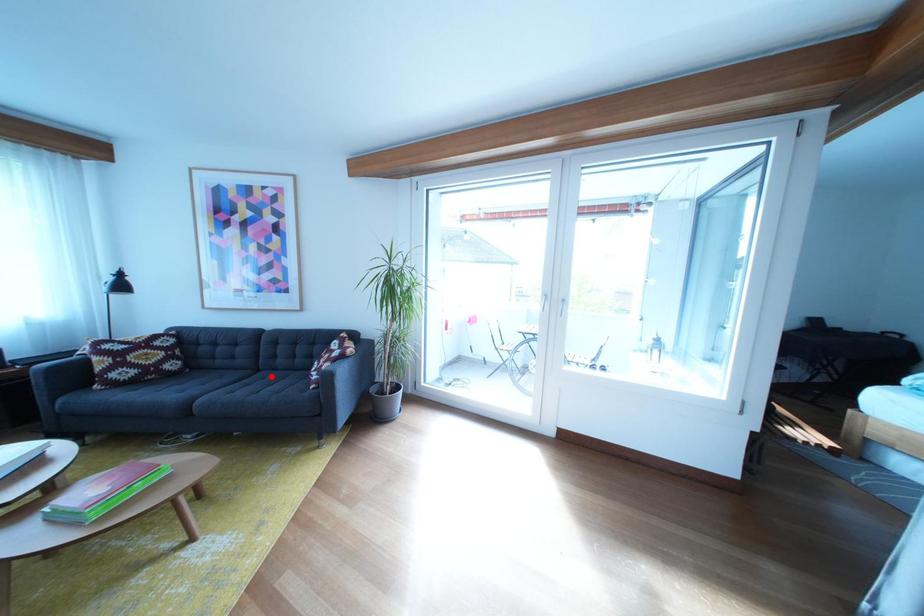
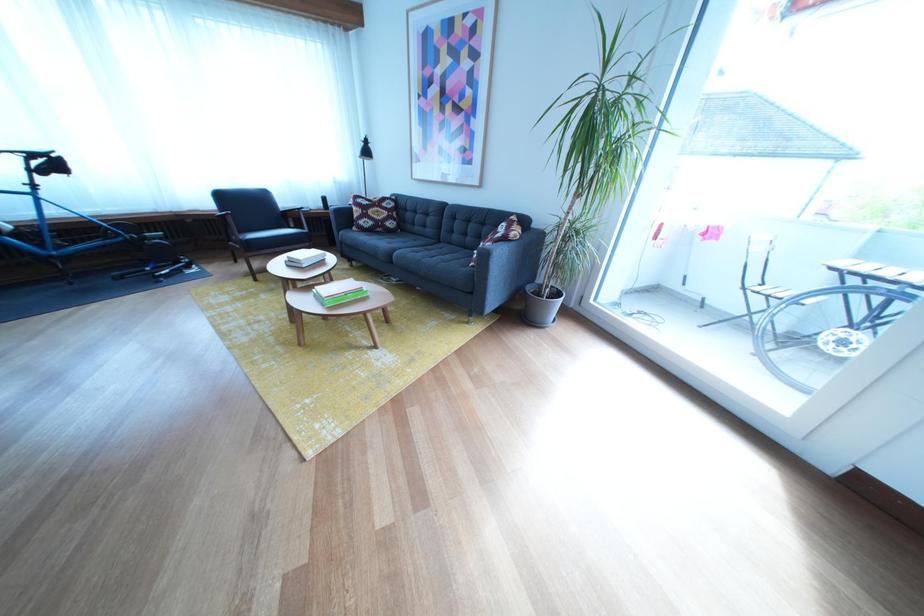
The point at the highlighted location is marked in the first image. Where is the corresponding point in the second image?

(453, 248)